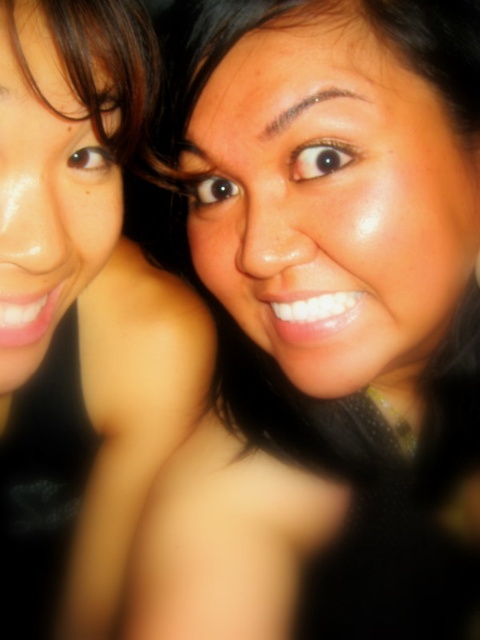
Between smooth skin face at upper right and matte skin at upper center, which one is positioned lower?

Positioned lower is smooth skin face at upper right.

Is point (432, 36) positioned before point (45, 120)?

No, it is behind (45, 120).

You are a GUI agent. You are given a task and a screenshot of the screen. Output one action in this format:
    pyautogui.click(x=<x>, y=<y>)
    Task: Click on the smooth skin face at upper right
    Image resolution: width=480 pixels, height=640 pixels.
    Given the screenshot: What is the action you would take?
    pyautogui.click(x=323, y=321)